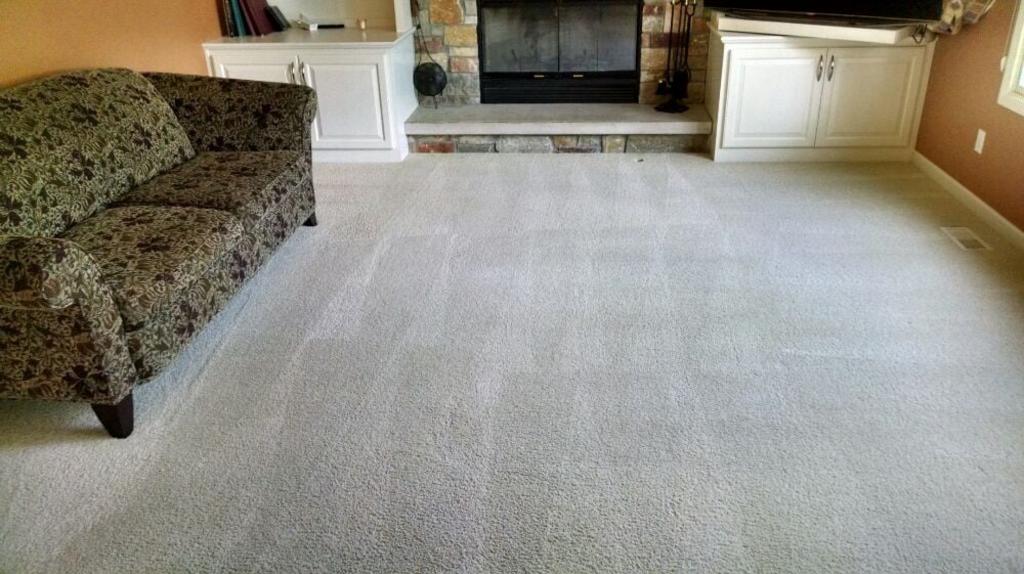
The image size is (1024, 574). I want to click on outlet, so click(981, 139).